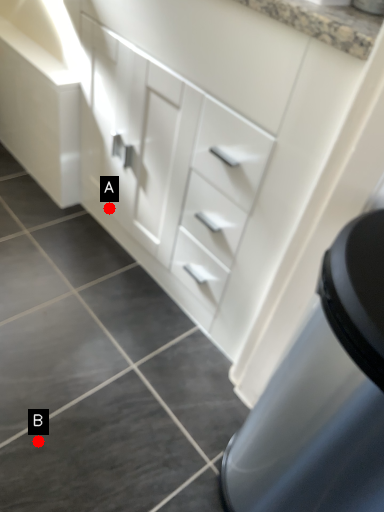
Question: Two points are circled on the image, labeled by A and B beside each circle. Which of the following is the farthest from the observer?

Choices:
 (A) A is further
 (B) B is further

Answer: (A)